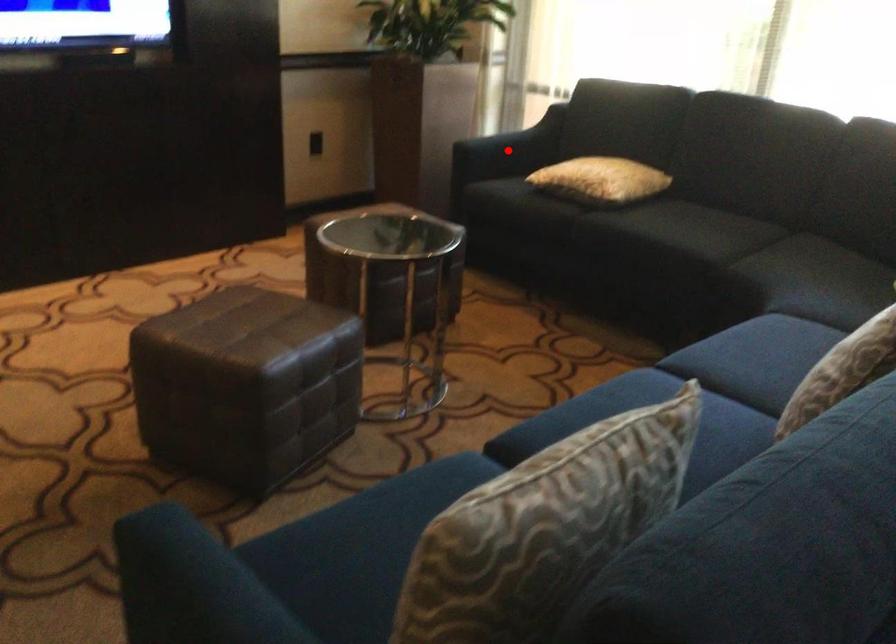
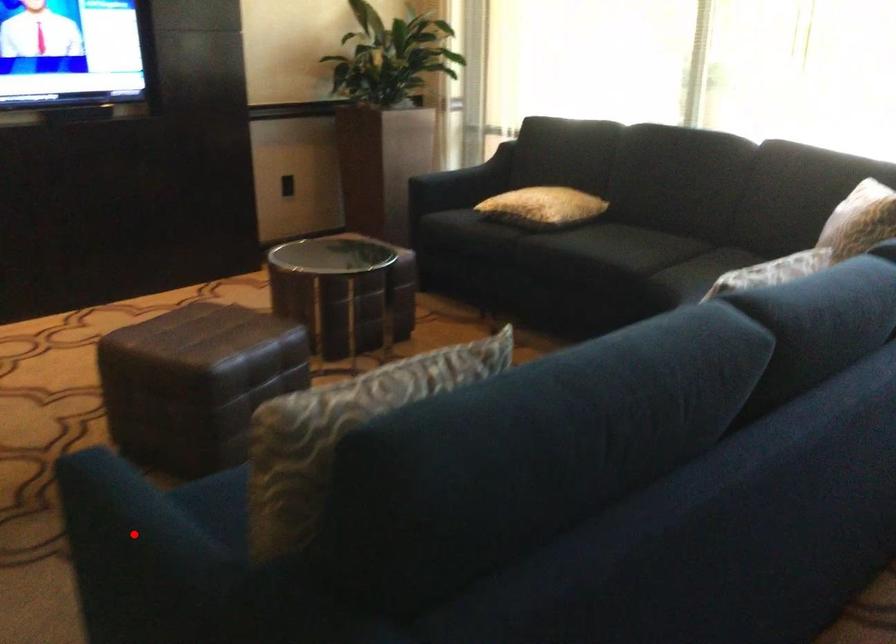
I am providing you with two images of the same scene from different viewpoints. A red point is marked on the first image and another point is marked on the second image. Is the marked point in image1 the same physical position as the marked point in image2?

No